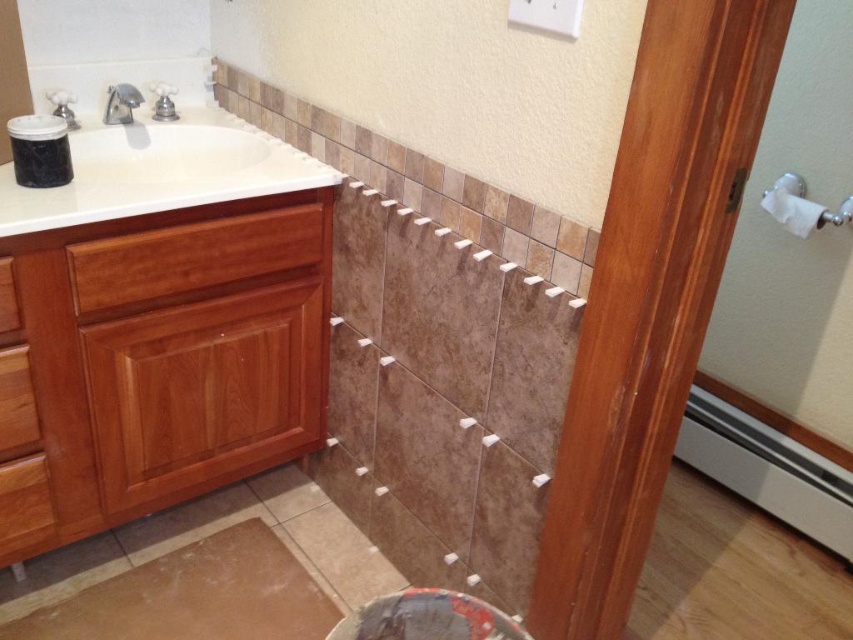
Question: Which point is farther to the camera?

Choices:
 (A) (180, 173)
 (B) (389, 605)

Answer: (A)

Question: Can you confirm if white glossy sink at upper left is positioned to the right of smooth dark red stool at lower center?

Choices:
 (A) yes
 (B) no

Answer: (B)

Question: Is smooth dark red stool at lower center in front of silver metallic faucet at upper left?

Choices:
 (A) no
 (B) yes

Answer: (B)

Question: Does white glossy sink at upper left appear on the left side of smooth dark red stool at lower center?

Choices:
 (A) no
 (B) yes

Answer: (B)

Question: Which point is farther from the camera taking this photo?

Choices:
 (A) click(x=144, y=141)
 (B) click(x=392, y=621)
 (C) click(x=119, y=120)

Answer: (A)

Question: Which of these objects is positioned closest to the white glossy sink at upper left?

Choices:
 (A) smooth dark red stool at lower center
 (B) silver metallic faucet at upper left

Answer: (B)